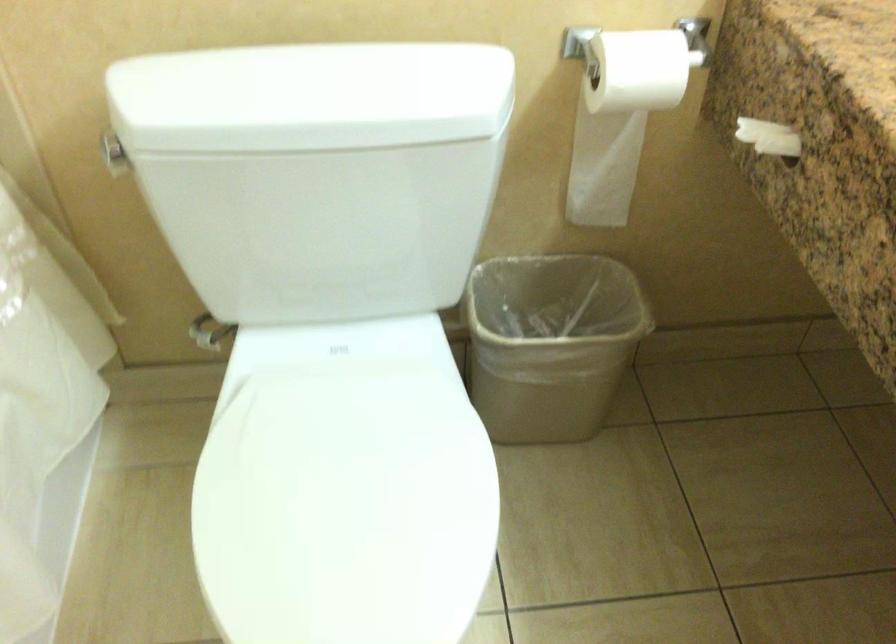
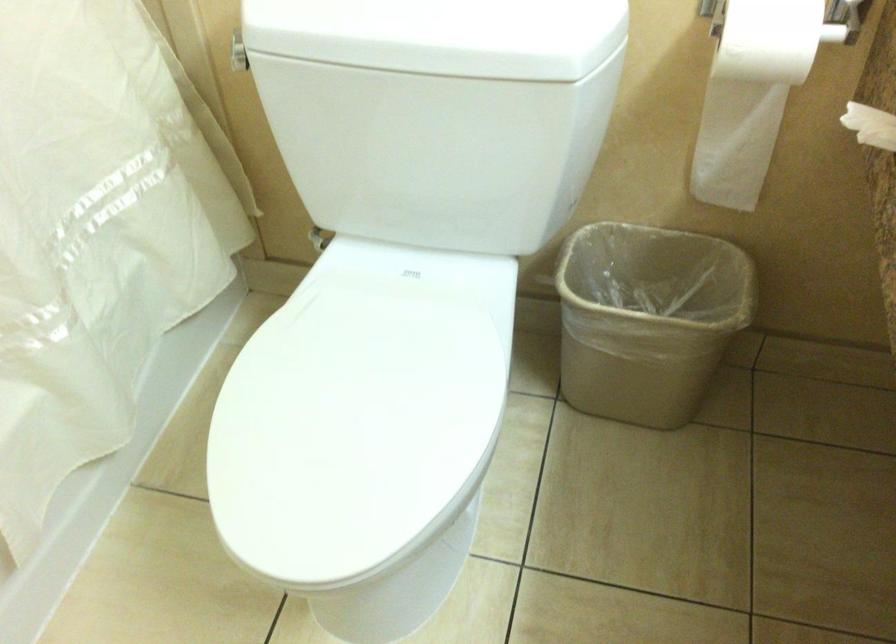
In the second image, find the point that corresponds to (x=307, y=111) in the first image.

(393, 35)